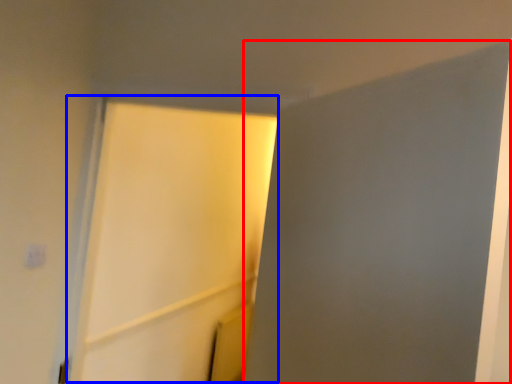
Question: Which object appears farthest to the camera in this image, screen door (highlighted by a red box) or screen door (highlighted by a blue box)?

Choices:
 (A) screen door
 (B) screen door

Answer: (B)